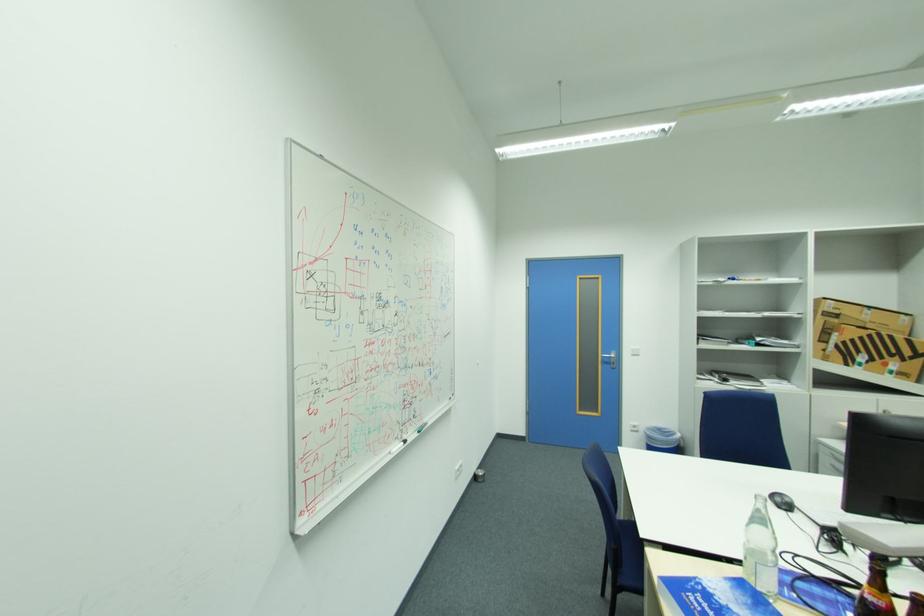
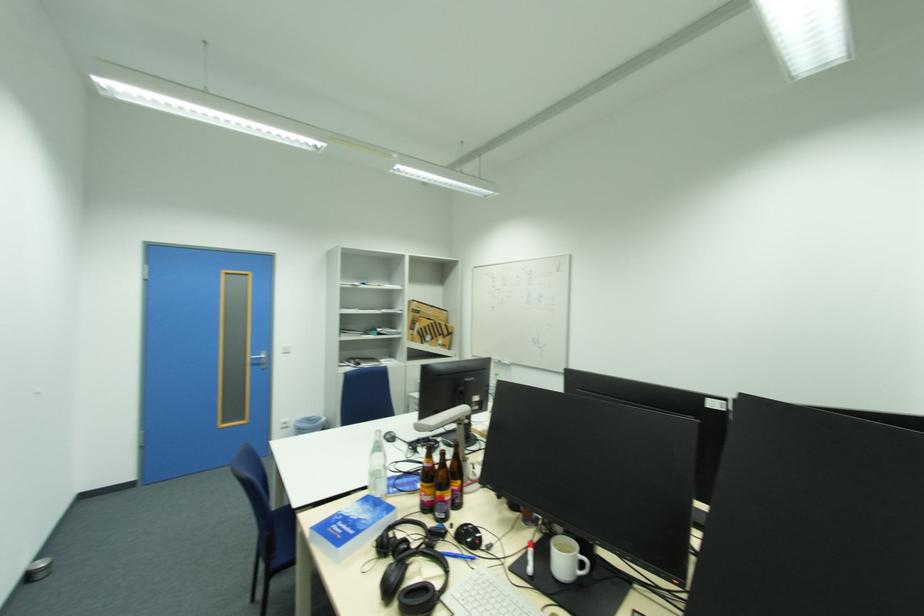
The point at (608, 358) is marked in the first image. Where is the corresponding point in the second image?

(258, 360)